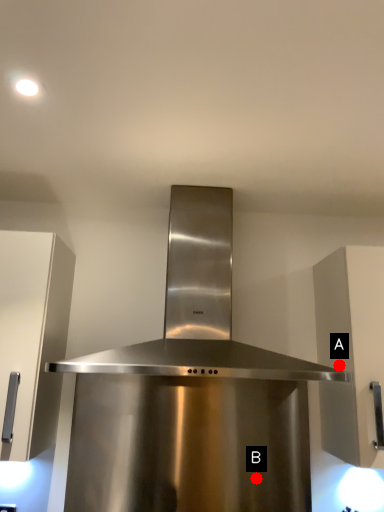
Question: Two points are circled on the image, labeled by A and B beside each circle. Which point appears farthest from the camera in this image?

Choices:
 (A) A is further
 (B) B is further

Answer: (B)